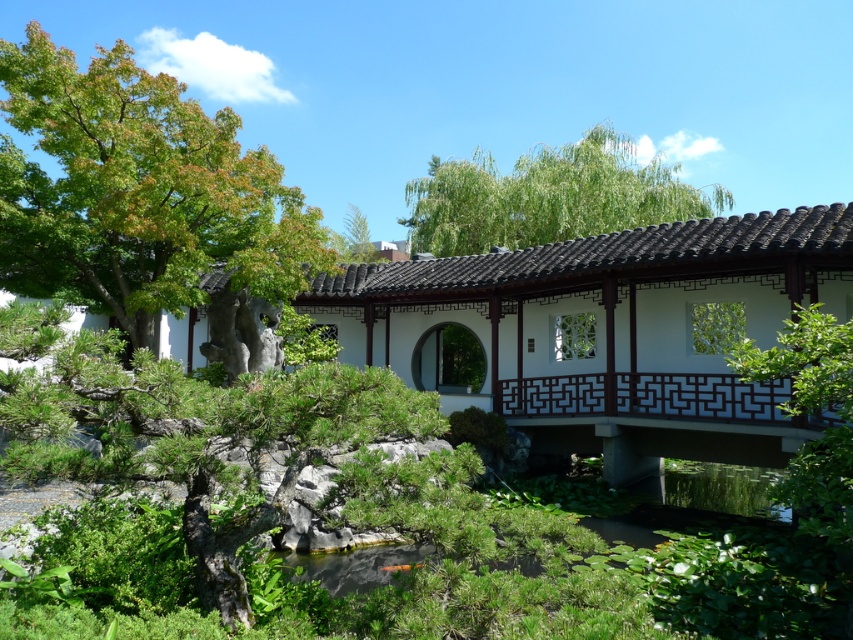
Question: From the image, what is the correct spatial relationship of white wood bridge at center in relation to green leafy tree at left?

Choices:
 (A) left
 (B) right

Answer: (B)

Question: Which object is the farthest from the white wood bridge at center?

Choices:
 (A) green leafy tree at upper center
 (B) green leafy tree at left

Answer: (A)

Question: Does green leafy tree at left have a lesser width compared to green leafy tree at upper center?

Choices:
 (A) yes
 (B) no

Answer: (A)

Question: Is white wood bridge at center thinner than green leafy tree at upper center?

Choices:
 (A) yes
 (B) no

Answer: (A)

Question: Which of these objects is positioned farthest from the green leafy tree at left?

Choices:
 (A) white wood bridge at center
 (B) green leafy tree at upper center

Answer: (B)

Question: Which point is farther to the camera?

Choices:
 (A) white wood bridge at center
 (B) green leafy tree at upper center
 (C) green leafy tree at left

Answer: (B)